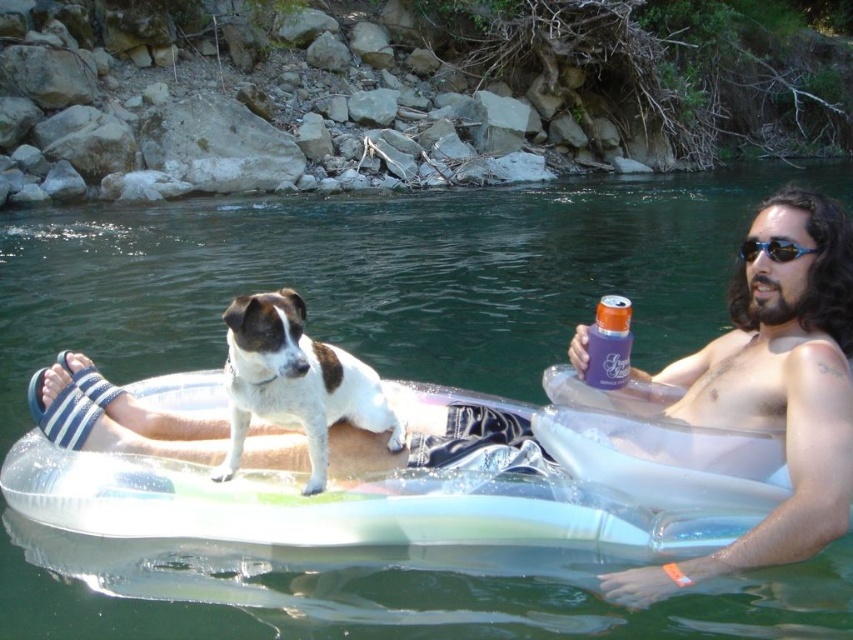
You are a photographer trying to capture the perfect shot of the white fur dog at center. According to the coordinates provided, where exactly should you aim your camera to ensure the dog is centered in the frame?

To center the white fur dog at center in your frame, aim your camera at the coordinates point [294,381] as the dog is positioned there.

Based on the photo, you are standing on the edge of the pool and want to toss a ball to the white fur dog at center. If you can throw the ball up to 10 feet, will it reach the dog?

The distance of white fur dog at center from viewer is 8.52 feet, so yes, the ball can reach the dog since the throwing distance is within the 10 feet range.

You are a photographer trying to capture a closeup of the white fur dog at center and the blue plastic sunglasses at upper right. Which object should you zoom in on to ensure both are in focus without moving the camera?

The white fur dog at center is wider than the blue plastic sunglasses at upper right, so you should zoom in on the white fur dog at center to ensure both are in focus.